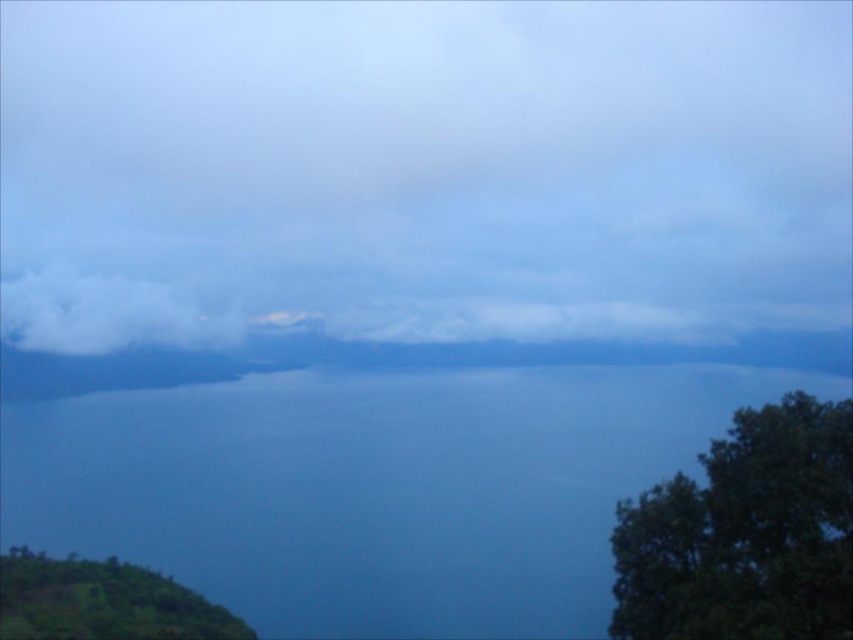
Does blue water at center have a lesser height compared to dark green leafy tree at lower right?

Yes.

Which of these two, blue water at center or dark green leafy tree at lower right, stands shorter?

blue water at center

I want to click on blue water at center, so click(x=374, y=486).

Consider the image. Is blue water at center positioned at the back of green leafy hillside at lower left?

Yes, blue water at center is behind green leafy hillside at lower left.

Which of these two, blue water at center or green leafy hillside at lower left, stands taller?

green leafy hillside at lower left is taller.

Is point (598, 442) closer to viewer compared to point (12, 595)?

No.

Where is `blue water at center`? blue water at center is located at coordinates (374, 486).

Who is positioned more to the left, dark green leafy tree at lower right or green leafy hillside at lower left?

Positioned to the left is green leafy hillside at lower left.

Does dark green leafy tree at lower right have a greater height compared to green leafy hillside at lower left?

Yes, dark green leafy tree at lower right is taller than green leafy hillside at lower left.

Where is `dark green leafy tree at lower right`? This screenshot has height=640, width=853. dark green leafy tree at lower right is located at coordinates (746, 534).